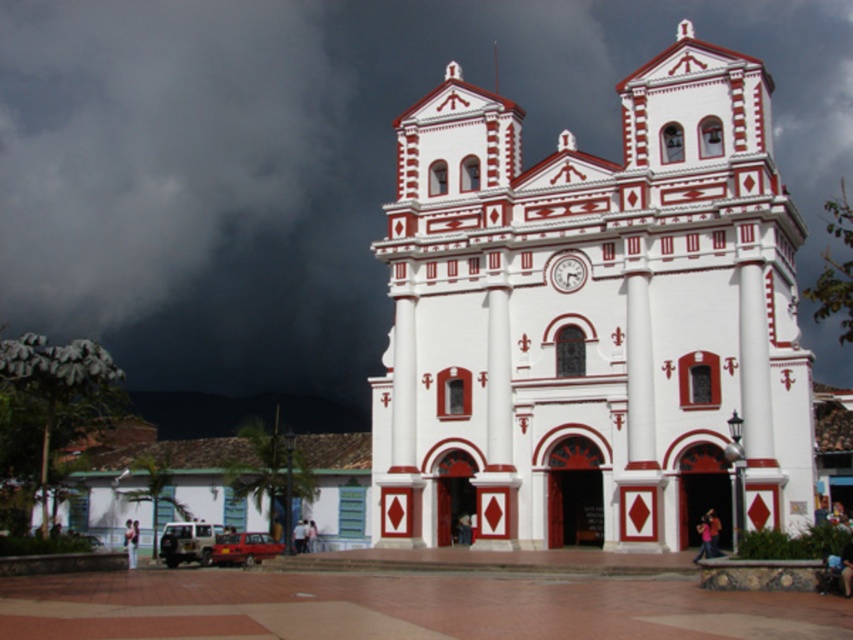
Question: Can you confirm if white painted stone church at center is positioned below dark gray cloud at upper left?

Choices:
 (A) no
 (B) yes

Answer: (B)

Question: Is white painted stone church at center bigger than dark gray cloud at upper left?

Choices:
 (A) no
 (B) yes

Answer: (A)

Question: Does white painted stone church at center have a lesser width compared to dark gray cloud at upper left?

Choices:
 (A) no
 (B) yes

Answer: (B)